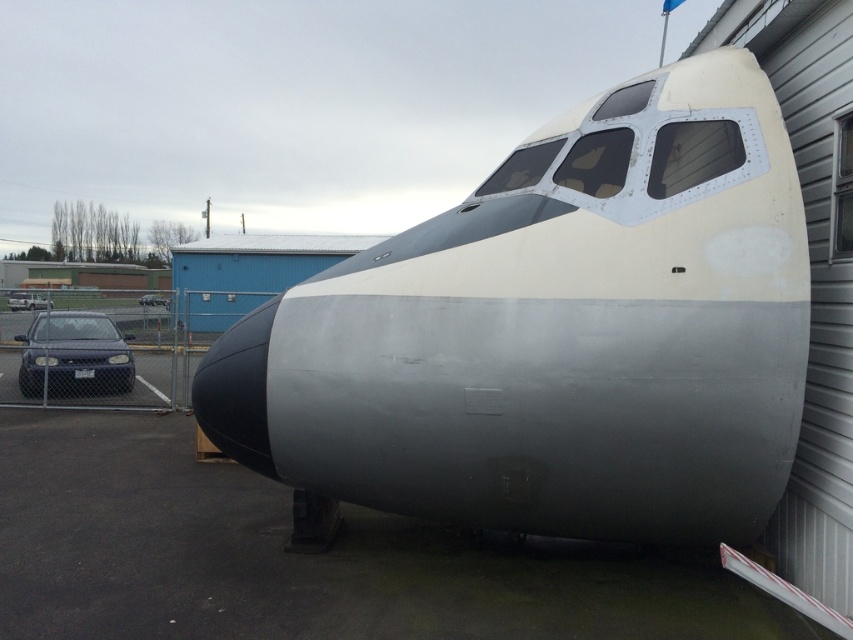
You are a parking attendant and need to fit both the matte blue car at lower left and the shiny blue sedan at lower left into a parking space that is 2 meters wide. Based on their widths, can both vehicles fit side by side in the space?

The matte blue car at lower left might be wider than the shiny blue sedan at lower left. Since the total width of both vehicles could exceed 2 meters, it is uncertain if they can fit side by side without overlapping.

You are standing in front of the aircraft fuselage and want to take a photo of the matte blue car at lower left and the shiny blue sedan at lower left. Which one will appear larger in your photo?

The matte blue car at lower left will appear larger in your photo because it is closer to the viewer than the shiny blue sedan at lower left.

You are standing near the aircraft fuselage and need to park your car. You see a matte blue car at lower left and a matte black car at left. Which car is positioned more to the left side?

The matte black car at left is positioned more to the left side than the matte blue car at lower left.